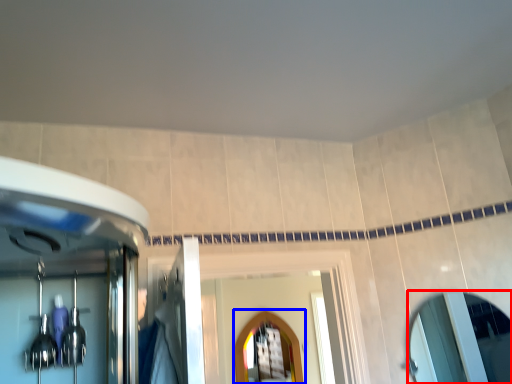
Question: Among these objects, which one is farthest to the camera, mirror (highlighted by a red box) or mirror (highlighted by a blue box)?

Choices:
 (A) mirror
 (B) mirror

Answer: (B)